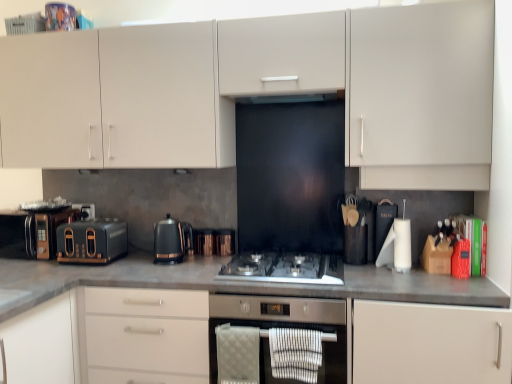
Question: Is matte black toaster at left, arranged as the third appliance when viewed from the right, wider or thinner than black metallic kettle at center, which ranks as the 2th kitchen appliance in left-to-right order?

Choices:
 (A) thin
 (B) wide

Answer: (B)

Question: Is matte black toaster at left, arranged as the third appliance when viewed from the right, in front of or behind black metallic kettle at center, which appears as the 1th kitchen appliance when viewed from the right, in the image?

Choices:
 (A) behind
 (B) front

Answer: (A)

Question: Estimate the real-world distances between objects in this image. Which object is farther from the black metallic toaster at left, the 2th appliance viewed from the left?

Choices:
 (A) stainless steel gas stove at center
 (B) black metallic kettle at center, which appears as the 1th kitchen appliance when viewed from the right
 (C) black matte exhaust hood at center
 (D) matte black toaster at left, positioned as the first kitchen appliance in left-to-right order
 (E) matte white cabinet at center, which is the first cabinetry from bottom to top

Answer: (C)

Question: Estimate the real-world distances between objects in this image. Which object is closer to the black metallic kettle at center, which ranks as the 2th kitchen appliance in left-to-right order?

Choices:
 (A) matte black toaster at left, placed as the 1th appliance when sorted from left to right
 (B) stainless steel gas stove at center
 (C) black metallic toaster at left, the 2th appliance viewed from the left
 (D) matte black toaster at left, placed as the second kitchen appliance when sorted from right to left
 (E) matte white cabinet at center, which is the first cabinetry from bottom to top

Answer: (D)